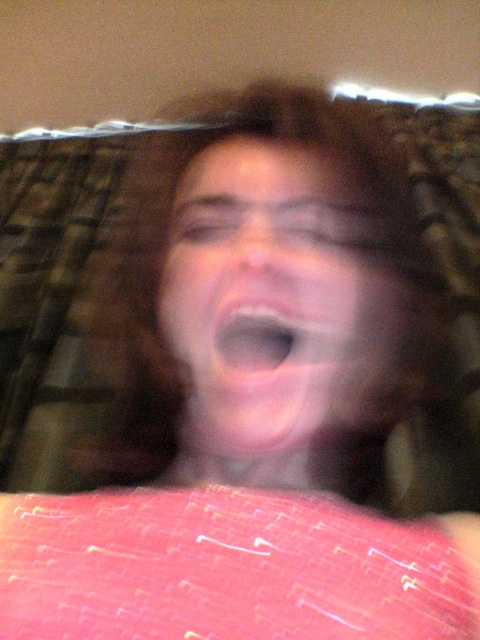
Which is below, pink matte face at center or pink flesh-colored mouth at center?

Positioned lower is pink flesh-colored mouth at center.

Is pink matte face at center positioned behind pink flesh-colored mouth at center?

That is False.

Image resolution: width=480 pixels, height=640 pixels. Identify the location of pink matte face at center. (273, 301).